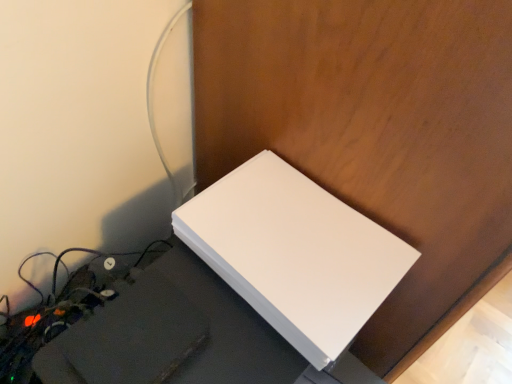
Question: Would you say white matte computer desk at lower left is to the left or to the right of white matte wii at center in the picture?

Choices:
 (A) left
 (B) right

Answer: (A)

Question: Which is correct: white matte computer desk at lower left is inside white matte wii at center, or outside of it?

Choices:
 (A) outside
 (B) inside

Answer: (A)

Question: Looking at their shapes, would you say white matte computer desk at lower left is wider or thinner than white matte wii at center?

Choices:
 (A) wide
 (B) thin

Answer: (A)

Question: Based on their positions, is white matte wii at center located to the left or right of white matte computer desk at lower left?

Choices:
 (A) right
 (B) left

Answer: (A)

Question: In the image, is white matte wii at center positioned in front of or behind white matte computer desk at lower left?

Choices:
 (A) behind
 (B) front

Answer: (A)

Question: In terms of size, does white matte wii at center appear bigger or smaller than white matte computer desk at lower left?

Choices:
 (A) small
 (B) big

Answer: (A)

Question: In terms of height, does white matte wii at center look taller or shorter compared to white matte computer desk at lower left?

Choices:
 (A) tall
 (B) short

Answer: (B)